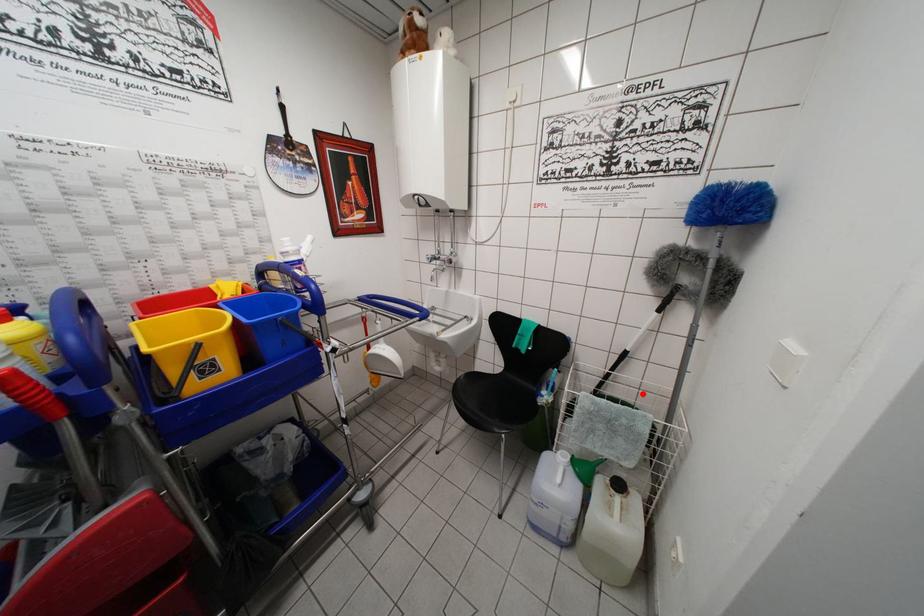
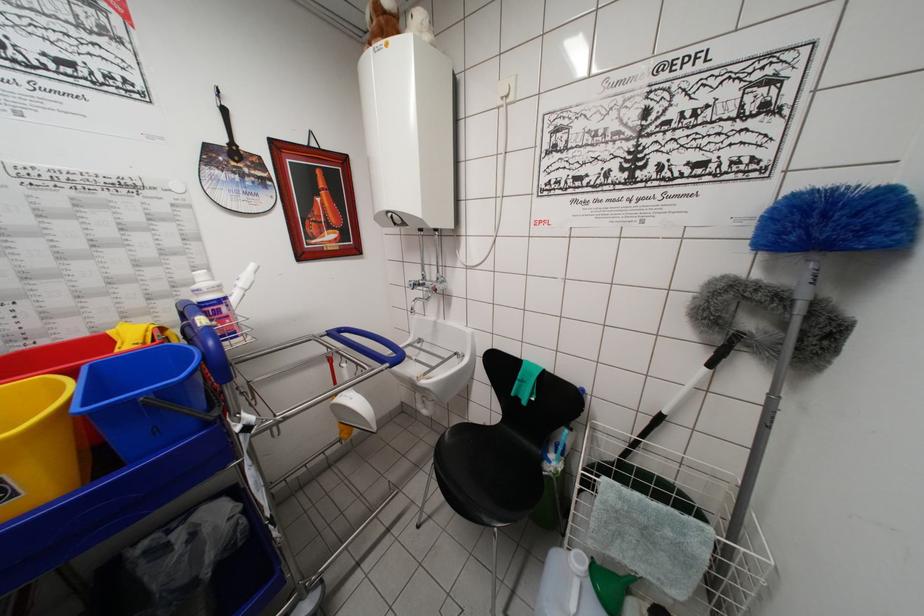
In the second image, find the point that corresponds to the highlighted location in the first image.

(685, 469)